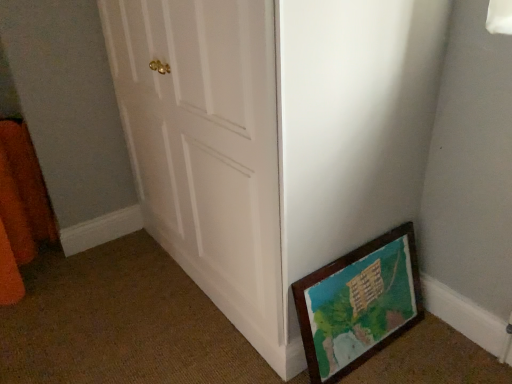
Measure the distance between white wooden door at center and camera.

85.15 centimeters.

What do you see at coordinates (274, 138) in the screenshot?
I see `white wooden door at center` at bounding box center [274, 138].

At what (x,y) coordinates should I click in order to perform the action: click on white wooden door at center. Please return your answer as a coordinate pair (x, y). The width and height of the screenshot is (512, 384). Looking at the image, I should click on (274, 138).

Which is farther, (x=408, y=261) or (x=410, y=214)?

The point (x=408, y=261) is more distant.

From the image's perspective, is wooden picture frame at lower right positioned above or below white wooden door at center?

wooden picture frame at lower right is situated lower than white wooden door at center in the image.

Measure the distance between wooden picture frame at lower right and white wooden door at center.

A distance of 12.79 inches exists between wooden picture frame at lower right and white wooden door at center.

Consider the image. Is white wooden door at center inside wooden picture frame at lower right?

No, white wooden door at center is not a part of wooden picture frame at lower right.

Which of these two, orange fuzzy curtain at left or white wooden door at center, is wider?

Wider between the two is white wooden door at center.

Is orange fuzzy curtain at left taller than white wooden door at center?

No, orange fuzzy curtain at left is not taller than white wooden door at center.

What's the angular difference between orange fuzzy curtain at left and white wooden door at center's facing directions?

The angular difference between orange fuzzy curtain at left and white wooden door at center is 89.1 degrees.

Consider the image. How many degrees apart are the facing directions of white wooden door at center and wooden picture frame at lower right?

90.5 degrees.

In the scene shown: Is white wooden door at center looking in the opposite direction of wooden picture frame at lower right?

No, white wooden door at center is not facing the opposite direction of wooden picture frame at lower right.

Is white wooden door at center smaller than wooden picture frame at lower right?

No.

Would you say wooden picture frame at lower right is part of white wooden door at center's contents?

Yes, wooden picture frame at lower right can be found within white wooden door at center.

Consider the image. Is wooden picture frame at lower right closer to the viewer compared to orange fuzzy curtain at left?

That is True.

Is point (396, 238) positioned behind point (36, 219)?

No, (396, 238) is closer to viewer.

Are wooden picture frame at lower right and orange fuzzy curtain at left located far from each other?

Indeed, wooden picture frame at lower right is not near orange fuzzy curtain at left.

From the image's perspective, which one is positioned higher, wooden picture frame at lower right or orange fuzzy curtain at left?

orange fuzzy curtain at left appears higher in the image.

You are a GUI agent. You are given a task and a screenshot of the screen. Output one action in this format:
    pyautogui.click(x=<x>, y=<y>)
    Task: Click on the door to the right of orange fuzzy curtain at left
    
    Given the screenshot: What is the action you would take?
    pyautogui.click(x=274, y=138)

From the picture: Can you confirm if white wooden door at center is positioned to the left of orange fuzzy curtain at left?

No, white wooden door at center is not to the left of orange fuzzy curtain at left.

Is white wooden door at center in front of or behind orange fuzzy curtain at left in the image?

white wooden door at center is positioned closer to the viewer than orange fuzzy curtain at left.

In the scene shown: From a real-world perspective, relative to orange fuzzy curtain at left, is white wooden door at center vertically above or below?

white wooden door at center is above orange fuzzy curtain at left.

Is orange fuzzy curtain at left positioned with its back to wooden picture frame at lower right?

orange fuzzy curtain at left is not turned away from wooden picture frame at lower right.

Can you see orange fuzzy curtain at left touching wooden picture frame at lower right?

No, orange fuzzy curtain at left is not with wooden picture frame at lower right.

In the image, is orange fuzzy curtain at left on the left side or the right side of wooden picture frame at lower right?

Clearly, orange fuzzy curtain at left is on the left of wooden picture frame at lower right in the image.

Which object is more forward, orange fuzzy curtain at left or wooden picture frame at lower right?

wooden picture frame at lower right is closer to the camera.

The width and height of the screenshot is (512, 384). Identify the location of picture frame that appears on the right of white wooden door at center. tap(360, 302).

The width and height of the screenshot is (512, 384). Find the location of `curtain behind the white wooden door at center`. curtain behind the white wooden door at center is located at coordinates (23, 195).

From the image, which object appears to be farther from orange fuzzy curtain at left, wooden picture frame at lower right or white wooden door at center?

wooden picture frame at lower right.

When comparing their distances from orange fuzzy curtain at left, does white wooden door at center or wooden picture frame at lower right seem closer?

white wooden door at center is closer to orange fuzzy curtain at left.

Estimate the real-world distances between objects in this image. Which object is further from wooden picture frame at lower right, orange fuzzy curtain at left or white wooden door at center?

The object further to wooden picture frame at lower right is orange fuzzy curtain at left.

Based on their spatial positions, is wooden picture frame at lower right or orange fuzzy curtain at left further from white wooden door at center?

Based on the image, orange fuzzy curtain at left appears to be further to white wooden door at center.

Looking at the image, which one is located further to wooden picture frame at lower right, white wooden door at center or orange fuzzy curtain at left?

orange fuzzy curtain at left lies further to wooden picture frame at lower right than the other object.

From the image, which object appears to be nearer to white wooden door at center, orange fuzzy curtain at left or wooden picture frame at lower right?

wooden picture frame at lower right is positioned closer to the anchor white wooden door at center.

This screenshot has width=512, height=384. In order to click on door located between orange fuzzy curtain at left and wooden picture frame at lower right in the left-right direction in this screenshot , I will do `click(274, 138)`.